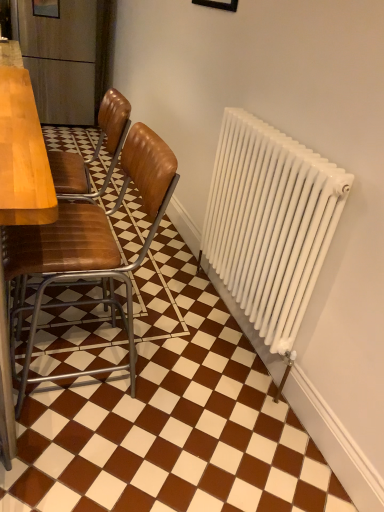
Find the location of a particular element. The width and height of the screenshot is (384, 512). vacant location below brown leather chair at left (from a real-world perspective) is located at coordinates (85, 364).